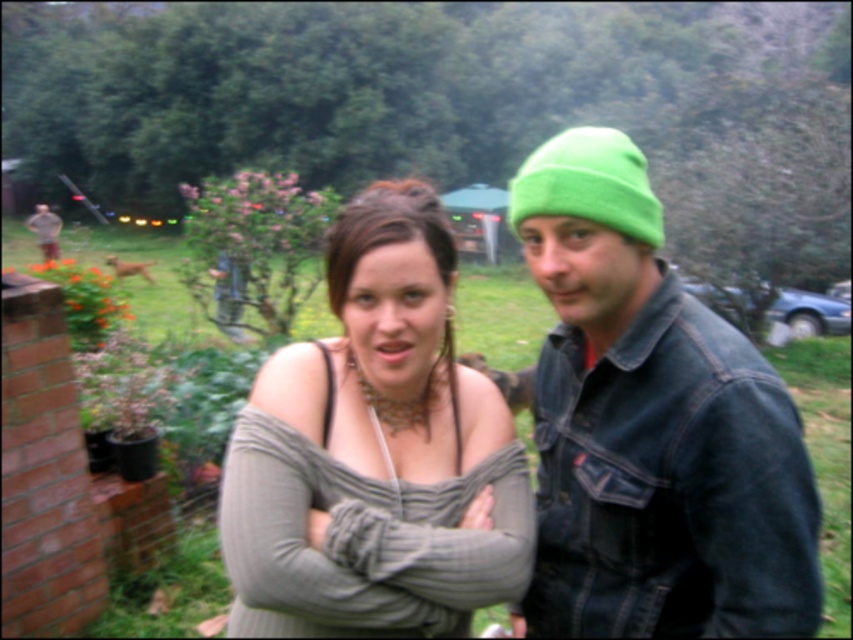
Can you confirm if green knit beanie at upper right is shorter than green fleece beanie at upper right?

Yes.

Does green knit beanie at upper right appear over green fleece beanie at upper right?

No.

Image resolution: width=853 pixels, height=640 pixels. I want to click on green knit beanie at upper right, so click(651, 426).

Find the location of a particular element. The height and width of the screenshot is (640, 853). green knit beanie at upper right is located at coordinates (651, 426).

Is green knit beanie at upper right below matte gray sweater at center?

No, green knit beanie at upper right is not below matte gray sweater at center.

Based on the photo, which is below, green knit beanie at upper right or matte gray sweater at center?

matte gray sweater at center

I want to click on green knit beanie at upper right, so click(651, 426).

Does matte gray sweater at center have a greater width compared to green fleece beanie at upper right?

No, matte gray sweater at center is not wider than green fleece beanie at upper right.

Where is `matte gray sweater at center`? This screenshot has width=853, height=640. matte gray sweater at center is located at coordinates (375, 452).

This screenshot has height=640, width=853. Identify the location of matte gray sweater at center. (x=375, y=452).